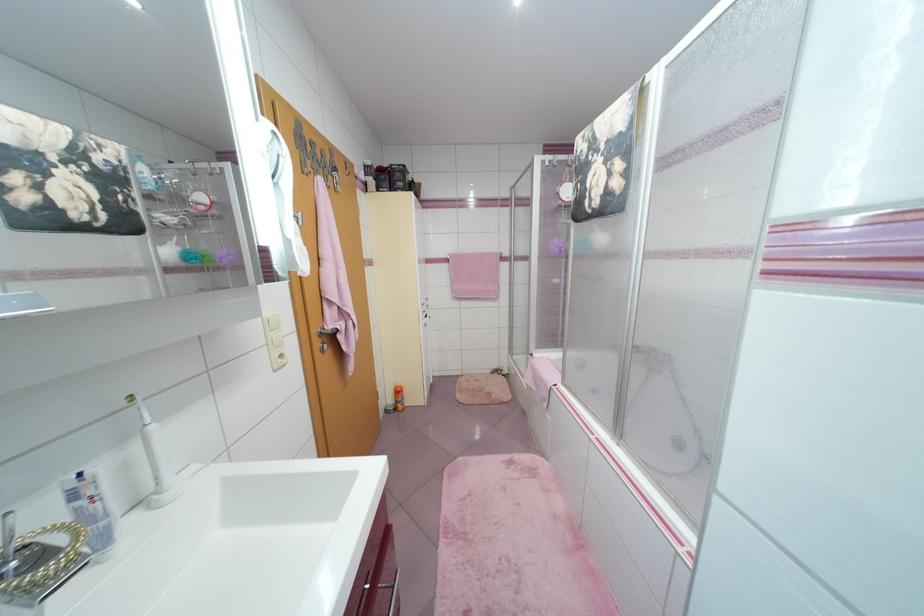
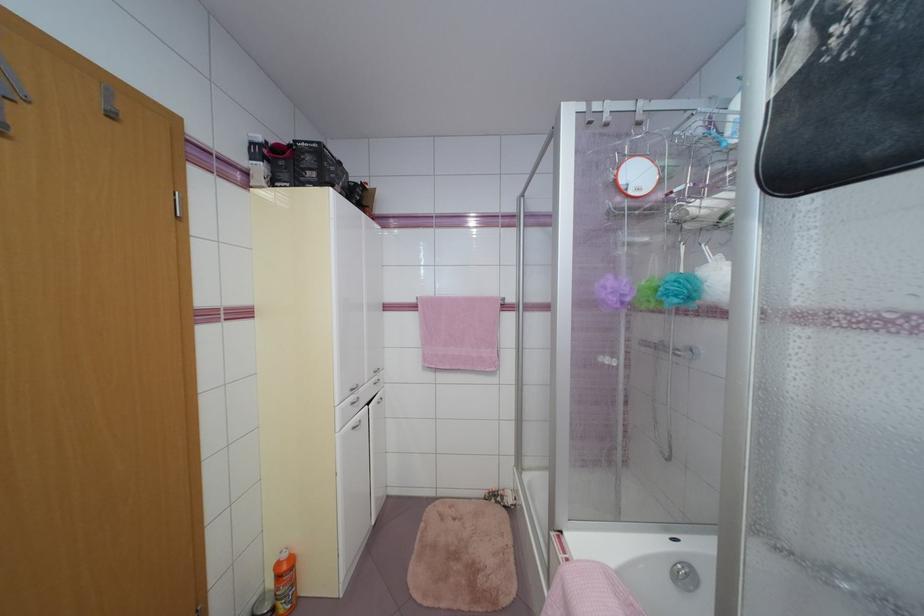
The point at (428, 310) is marked in the first image. Where is the corresponding point in the second image?

(357, 400)